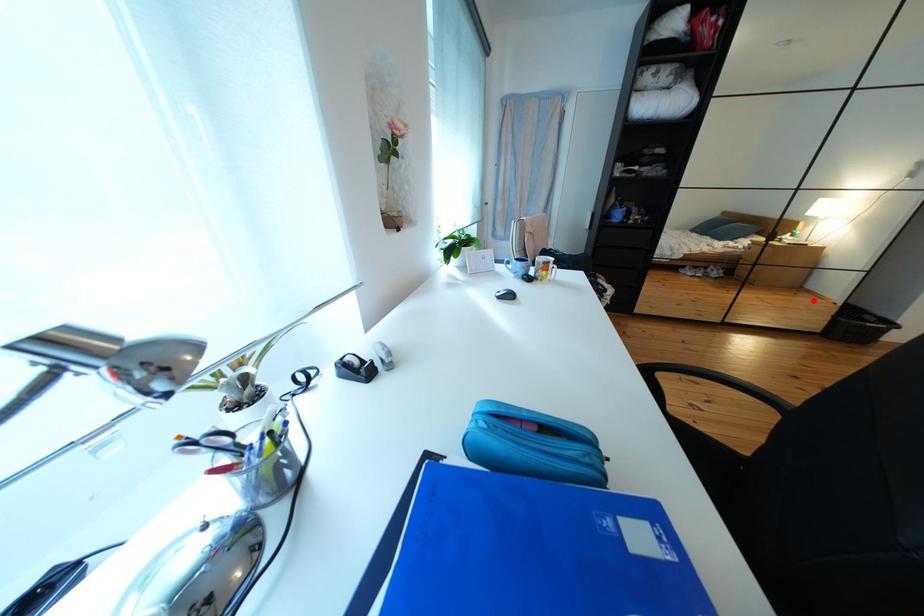
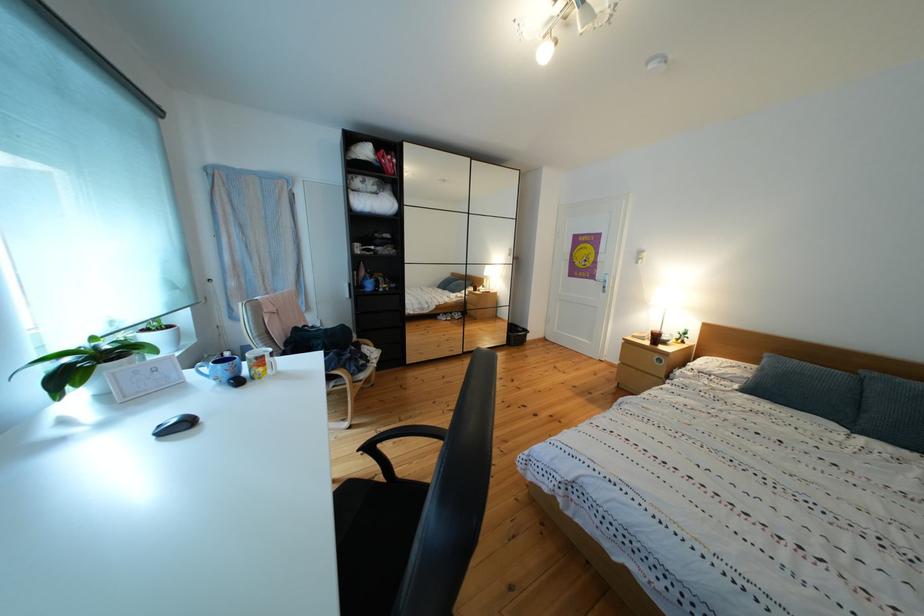
In the second image, find the point that corresponds to the highlighted location in the first image.

(508, 326)